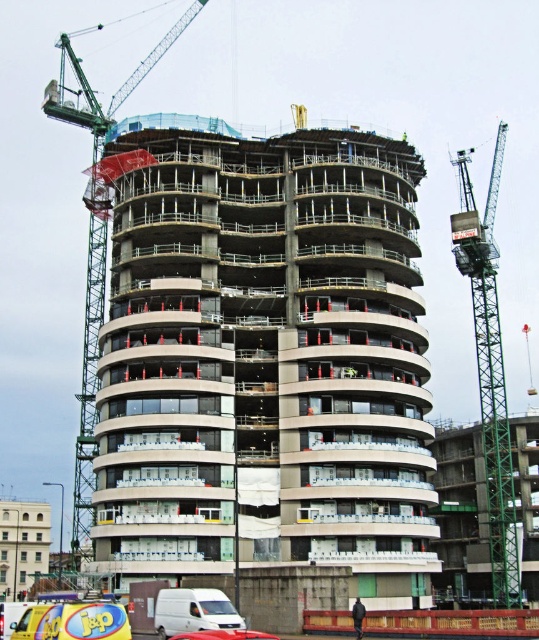
Based on the photo, you are an engineer inspecting the construction site. You need to move a heavy load from the ground to the third floor of the spiral building. The third floor has a balcony that extends outward. Can the green metallic crane at left reach the balcony on the third floor based on its current position?

The green metallic crane at left is located at point (95,244), which is close enough to the spiral building to reach its third floor balcony. Therefore, the crane can be used to move the heavy load to the balcony.

You are an engineer inspecting the construction site. You need to determine the position of the green metallic crane at right relative to the building. Based on the coordinates provided, can you confirm if the crane is positioned to the right side of the building?

The green metallic crane at right is located at point coordinates, so yes, it is positioned to the right side of the building.